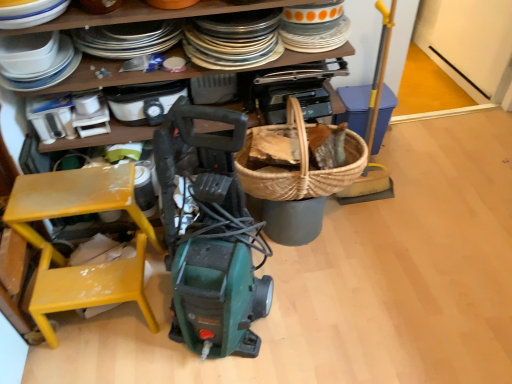
Where is `empty space that is ontop of woven basket at right, which is the first appliance in right-to-left order (from a real-world perspective)`? empty space that is ontop of woven basket at right, which is the first appliance in right-to-left order (from a real-world perspective) is located at coordinates (364, 99).